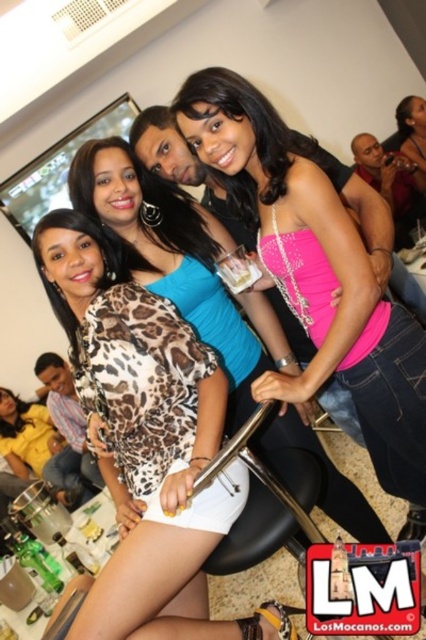
Is point (316, 221) positioned behind point (232, 272)?

No, it is not.

How distant is pink satin tank top at center from clear plastic cup at center?

pink satin tank top at center and clear plastic cup at center are 14.30 inches apart from each other.

Locate an element on the screen. This screenshot has height=640, width=426. pink satin tank top at center is located at coordinates (316, 273).

Is point (81, 636) positioned in front of point (233, 264)?

Yes, it is in front of point (233, 264).

Find the location of a particular element. Image resolution: width=426 pixels, height=640 pixels. leopard print blouse at center is located at coordinates (132, 362).

Who is positioned more to the right, pink satin tank top at center or pink satin dress at center?

From the viewer's perspective, pink satin dress at center appears more on the right side.

Is point (337, 317) positioned in front of point (402, 156)?

That is True.

The image size is (426, 640). What are the coordinates of `pink satin tank top at center` in the screenshot? It's located at (316, 273).

Where is `pink satin tank top at center`? pink satin tank top at center is located at coordinates (316, 273).